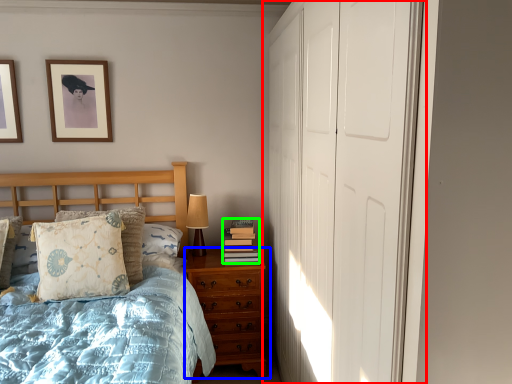
Question: Which object is the farthest from door (highlighted by a red box)? Choose among these: chest of drawers (highlighted by a blue box) or book (highlighted by a green box).

Choices:
 (A) chest of drawers
 (B) book

Answer: (B)